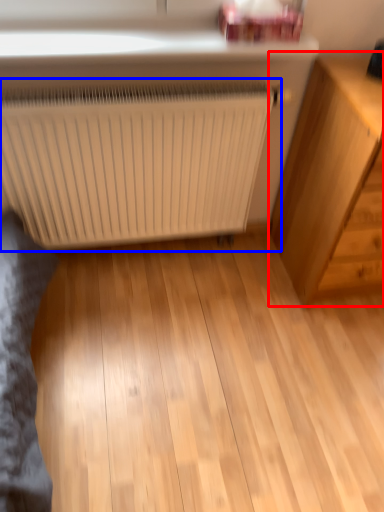
Question: Among these objects, which one is nearest to the camera, chest of drawers (highlighted by a red box) or radiator (highlighted by a blue box)?

Choices:
 (A) chest of drawers
 (B) radiator

Answer: (A)